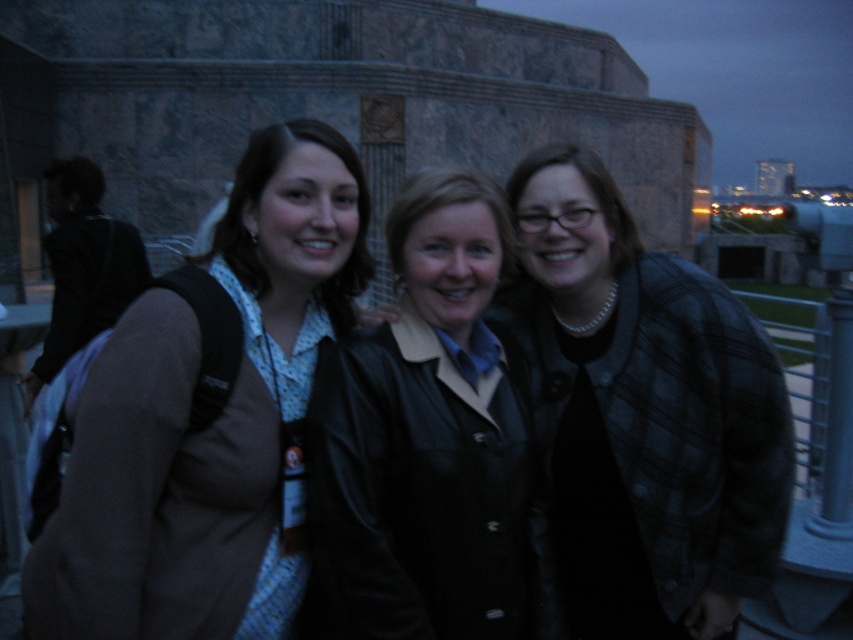
From the picture: Can you confirm if plaid wool jacket at center is taller than black leather jacket at center?

Yes, plaid wool jacket at center is taller than black leather jacket at center.

Can you confirm if plaid wool jacket at center is positioned above black leather jacket at center?

Indeed, plaid wool jacket at center is positioned over black leather jacket at center.

Is point (625, 481) less distant than point (482, 531)?

No, it is not.

Identify the location of plaid wool jacket at center. The height and width of the screenshot is (640, 853). (643, 413).

Is brown leather jacket at center bigger than plaid wool jacket at center?

No.

Which is in front, point (212, 310) or point (634, 308)?

Positioned in front is point (212, 310).

Between point (202, 452) and point (672, 429), which one is positioned in front?

Point (202, 452) is in front.

Identify the location of brown leather jacket at center. The height and width of the screenshot is (640, 853). (209, 417).

Does point (55, 636) come behind point (471, 545)?

That is False.

Is brown leather jacket at center below black leather jacket at center?

Actually, brown leather jacket at center is above black leather jacket at center.

Identify the location of brown leather jacket at center. (209, 417).

Where is `brown leather jacket at center`? brown leather jacket at center is located at coordinates (209, 417).